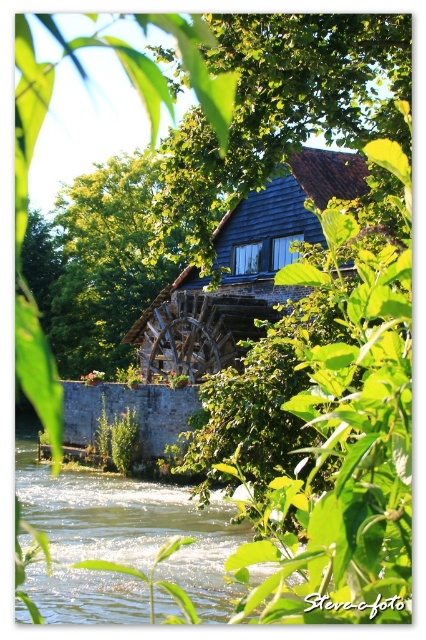
From the picture: Between green water at lower left and green leafy tree at center, which one is positioned higher?

green leafy tree at center

The width and height of the screenshot is (426, 640). In order to click on green water at lower left in this screenshot , I will do `click(121, 541)`.

Between green leafy tree at upper center and green leafy tree at center, which one appears on the right side from the viewer's perspective?

Positioned to the right is green leafy tree at upper center.

Can you confirm if green leafy tree at upper center is positioned below green leafy tree at center?

No.

Where is `green leafy tree at upper center`? Image resolution: width=426 pixels, height=640 pixels. green leafy tree at upper center is located at coordinates (281, 108).

Locate an element on the screen. This screenshot has height=640, width=426. green leafy tree at upper center is located at coordinates (281, 108).

Is green leafy tree at upper center above green water at lower left?

Yes.

Identify the location of green leafy tree at upper center. This screenshot has height=640, width=426. (281, 108).

Between point (209, 54) and point (221, 525), which one is positioned behind?

The point (221, 525) is behind.

The height and width of the screenshot is (640, 426). Find the location of `green leafy tree at upper center`. green leafy tree at upper center is located at coordinates (281, 108).